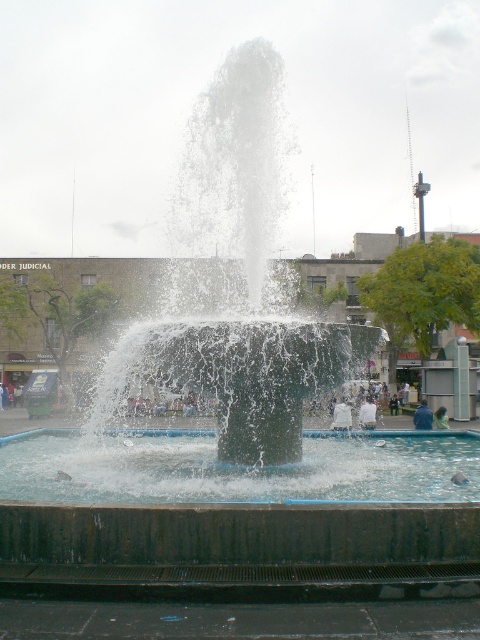
Question: Which of the following is the farthest from the observer?

Choices:
 (A) white cotton shirt at center
 (B) clear water at center
 (C) blue denim jacket at center

Answer: (A)

Question: Is clear water at center further to the viewer compared to white fabric shirt at center?

Choices:
 (A) yes
 (B) no

Answer: (B)

Question: Does white fabric shirt at center have a larger size compared to blue denim jacket at center?

Choices:
 (A) no
 (B) yes

Answer: (B)

Question: Estimate the real-world distances between objects in this image. Which object is closer to the white fabric shirt at center?

Choices:
 (A) light brown hair at center
 (B) black stone fountain at center
 (C) clear water at center

Answer: (A)

Question: Where is clear water at center located in relation to white fabric shirt at center in the image?

Choices:
 (A) below
 (B) above

Answer: (B)

Question: Which of the following is the farthest from the observer?

Choices:
 (A) (199, 216)
 (B) (421, 408)

Answer: (B)